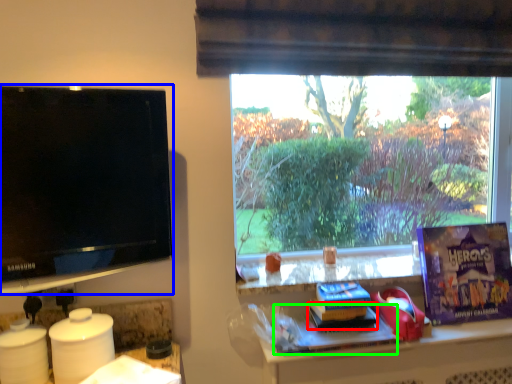
Question: Considering the real-world distances, which object is closest to book (highlighted by a red box)? television (highlighted by a blue box) or book (highlighted by a green box).

Choices:
 (A) television
 (B) book

Answer: (B)